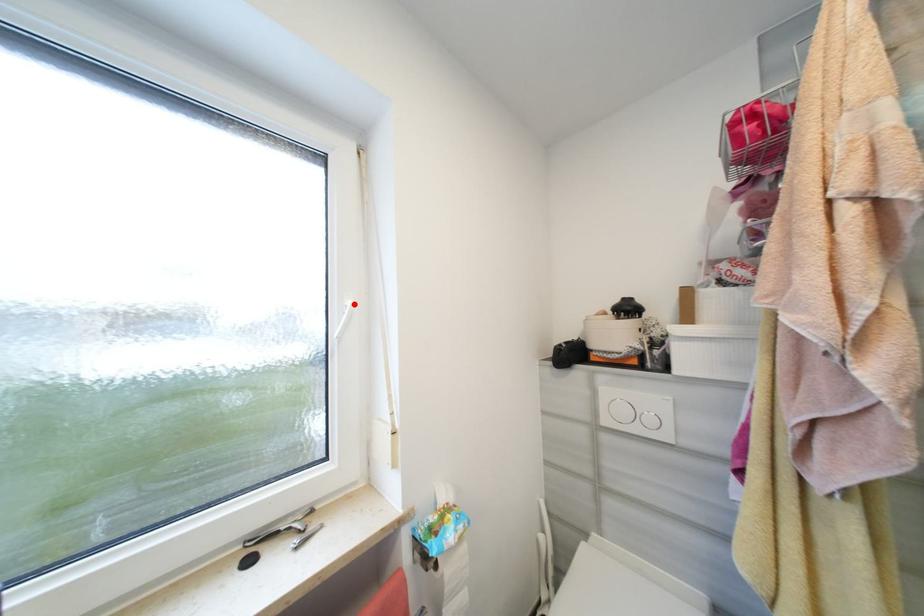
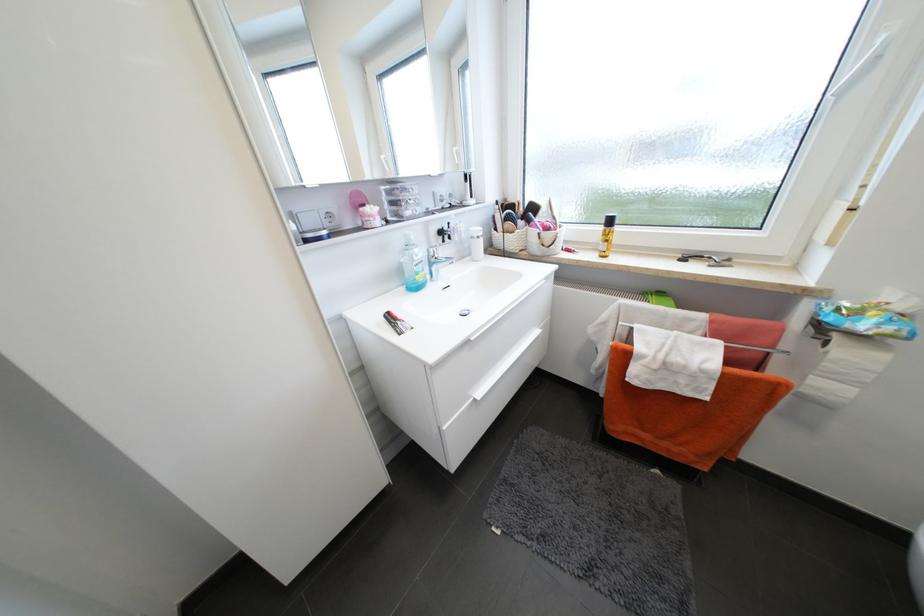
The point at the highlighted location is marked in the first image. Where is the corresponding point in the second image?

(888, 41)